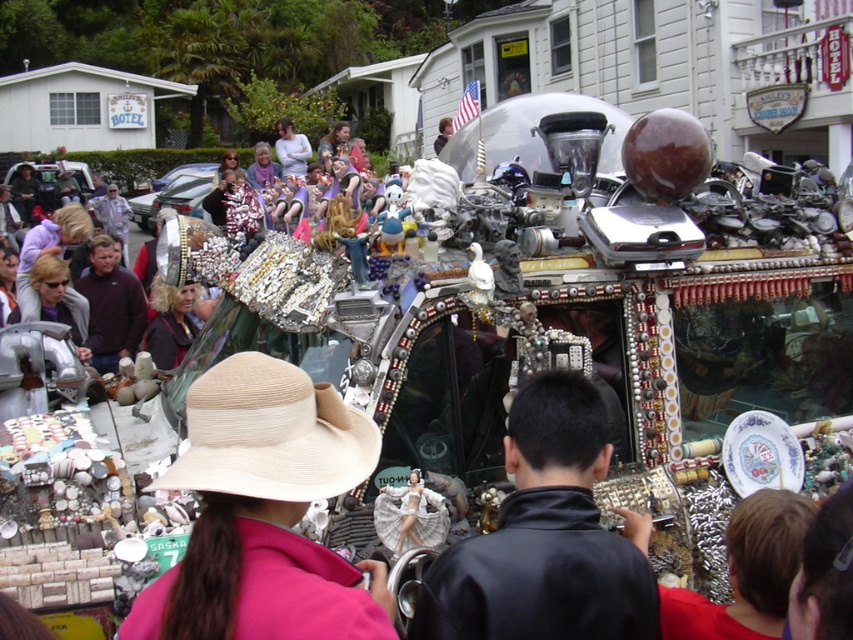
Between pink fabric hat at center and black leather jacket at center, which one appears on the right side from the viewer's perspective?

Positioned to the right is black leather jacket at center.

Can you confirm if pink fabric hat at center is smaller than black leather jacket at center?

Correct, pink fabric hat at center occupies less space than black leather jacket at center.

Which is in front, point (235, 456) or point (578, 609)?

Point (235, 456)

This screenshot has height=640, width=853. Find the location of `pink fabric hat at center`. pink fabric hat at center is located at coordinates pyautogui.click(x=264, y=513).

Does pink fabric hat at center have a lesser height compared to beige straw hat at center?

Incorrect, pink fabric hat at center's height does not fall short of beige straw hat at center's.

Does pink fabric hat at center have a lesser width compared to beige straw hat at center?

No.

The height and width of the screenshot is (640, 853). Find the location of `pink fabric hat at center`. pink fabric hat at center is located at coordinates (264, 513).

Consider the image. Is black leather jacket at center thinner than beige straw hat at center?

No, black leather jacket at center is not thinner than beige straw hat at center.

Which is behind, point (593, 614) or point (206, 384)?

The point (206, 384) is more distant.

Find the location of `black leather jacket at center`. black leather jacket at center is located at coordinates (546, 538).